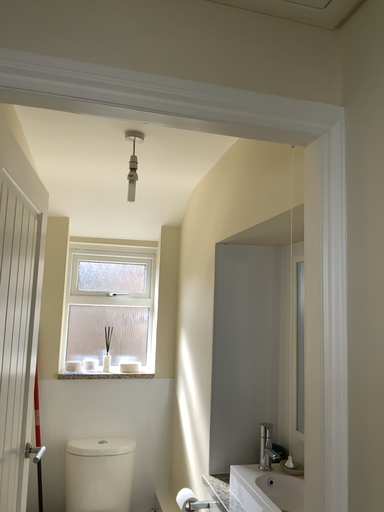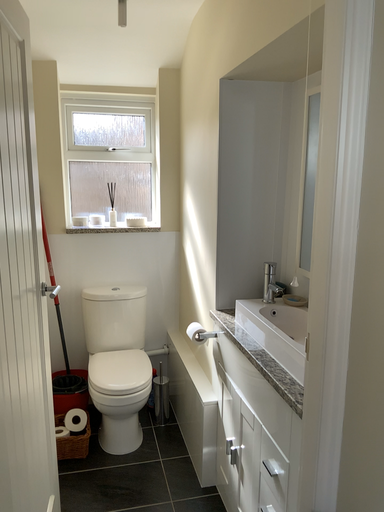
Question: Which way did the camera rotate in the video?

Choices:
 (A) rotated upward
 (B) rotated downward

Answer: (B)